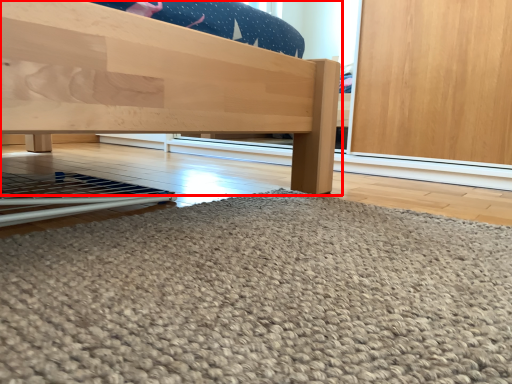
Question: Observing the image, what is the correct spatial positioning of furniture (annotated by the red box) in reference to door?

Choices:
 (A) right
 (B) left

Answer: (B)